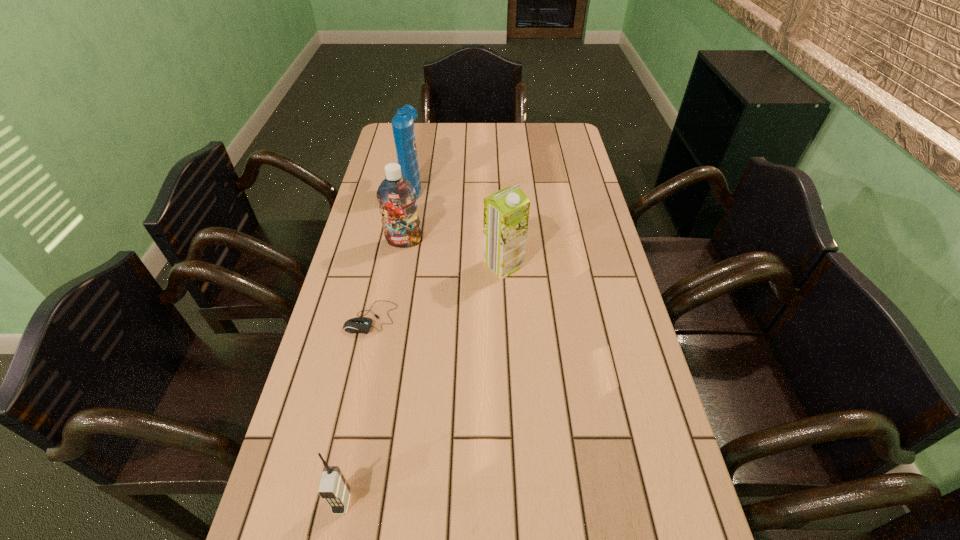
At what (x,y) coordinates should I click in order to perform the action: click on the farthest object. Please return your answer as a coordinate pair (x, y). This screenshot has height=540, width=960. Looking at the image, I should click on (403, 128).

Identify the location of soya milk. The width and height of the screenshot is (960, 540). (506, 212).

In order to click on the third nearest object in this screenshot , I will do `click(506, 212)`.

In order to click on the fourth nearest object in this screenshot , I will do `click(397, 197)`.

This screenshot has width=960, height=540. Identify the location of cellular telephone. (333, 487).

Find the location of `the nearest object`. the nearest object is located at coordinates (333, 487).

This screenshot has height=540, width=960. Identify the location of the second nearest object. (362, 325).

I want to click on the shortest object, so click(362, 325).

At what (x,y) coordinates should I click in order to perform the action: click on vacant space positioned 0.080m on the left of the farther shampoo. Please return your answer as a coordinate pair (x, y). Looking at the image, I should click on (379, 187).

Find the location of a particular element. This screenshot has height=540, width=960. vacant space located 0.300m on the back of the rightmost object is located at coordinates (499, 190).